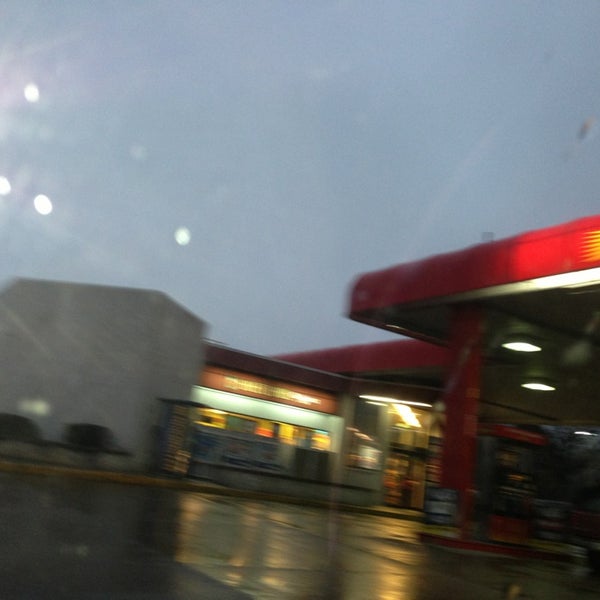
Image resolution: width=600 pixels, height=600 pixels. What are the coordinates of `light` in the screenshot? It's located at (410, 415).